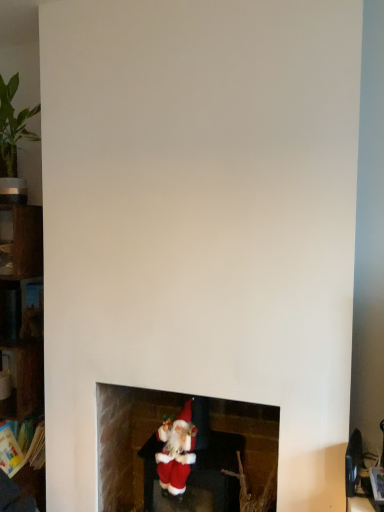
Question: From a real-world perspective, is velvet santa at lower center below red plush santa at lower center?

Choices:
 (A) no
 (B) yes

Answer: (A)

Question: Can you confirm if velvet santa at lower center is thinner than red plush santa at lower center?

Choices:
 (A) no
 (B) yes

Answer: (B)

Question: From a real-world perspective, does velvet santa at lower center stand above red plush santa at lower center?

Choices:
 (A) yes
 (B) no

Answer: (A)

Question: Is velvet santa at lower center smaller than red plush santa at lower center?

Choices:
 (A) no
 (B) yes

Answer: (B)

Question: Considering the relative sizes of velvet santa at lower center and red plush santa at lower center in the image provided, is velvet santa at lower center taller than red plush santa at lower center?

Choices:
 (A) yes
 (B) no

Answer: (B)

Question: Is wooden shelf at left, positioned as the second shelf in top-to-bottom order, inside the boundaries of velvet santa at lower center, or outside?

Choices:
 (A) inside
 (B) outside

Answer: (B)

Question: Considering the positions of wooden shelf at left, the 1th shelf from the bottom, and velvet santa at lower center in the image, is wooden shelf at left, the 1th shelf from the bottom, taller or shorter than velvet santa at lower center?

Choices:
 (A) tall
 (B) short

Answer: (A)

Question: Considering the positions of wooden shelf at left, the 1th shelf from the bottom, and velvet santa at lower center in the image, is wooden shelf at left, the 1th shelf from the bottom, bigger or smaller than velvet santa at lower center?

Choices:
 (A) small
 (B) big

Answer: (B)

Question: Visually, is wooden shelf at left, the 1th shelf from the bottom, positioned to the left or to the right of velvet santa at lower center?

Choices:
 (A) left
 (B) right

Answer: (A)

Question: Considering the positions of velvet santa at lower center and red plush santa at lower center in the image, is velvet santa at lower center bigger or smaller than red plush santa at lower center?

Choices:
 (A) small
 (B) big

Answer: (A)

Question: Is velvet santa at lower center wider or thinner than red plush santa at lower center?

Choices:
 (A) wide
 (B) thin

Answer: (B)

Question: From a real-world perspective, is velvet santa at lower center physically located above or below red plush santa at lower center?

Choices:
 (A) above
 (B) below

Answer: (A)

Question: From their relative heights in the image, would you say velvet santa at lower center is taller or shorter than red plush santa at lower center?

Choices:
 (A) short
 (B) tall

Answer: (A)

Question: In terms of height, does wooden shelf at left, the 1th shelf from the bottom, look taller or shorter compared to metallic dark gray shelf at left, the second shelf positioned from the bottom?

Choices:
 (A) tall
 (B) short

Answer: (A)

Question: Looking at their shapes, would you say wooden shelf at left, the 1th shelf from the bottom, is wider or thinner than metallic dark gray shelf at left, the 1th shelf in the top-to-bottom sequence?

Choices:
 (A) wide
 (B) thin

Answer: (A)